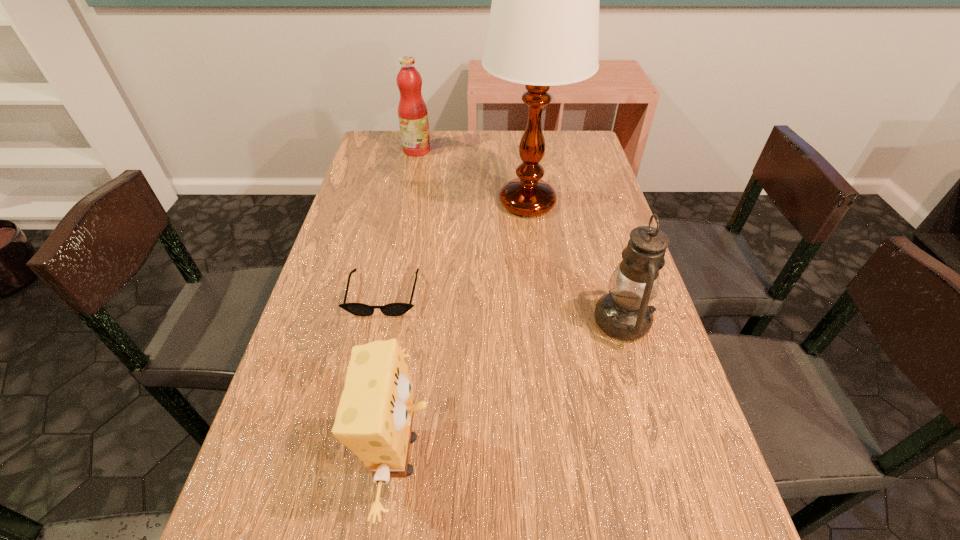
You are a GUI agent. You are given a task and a screenshot of the screen. Output one action in this format:
    pyautogui.click(x=<x>, y=<y>)
    Task: Click on the vacant area that satisfies the following two spatial constraints: 1. on the front label of the farthest object; 2. on the back side of the fourth nearest object
    The image size is (960, 540).
    Given the screenshot: What is the action you would take?
    pyautogui.click(x=406, y=202)

This screenshot has width=960, height=540. What are the coordinates of `vacant position in the image that satisfies the following two spatial constraints: 1. on the front label of the farthest object; 2. on the back side of the second farthest object` in the screenshot? It's located at (406, 202).